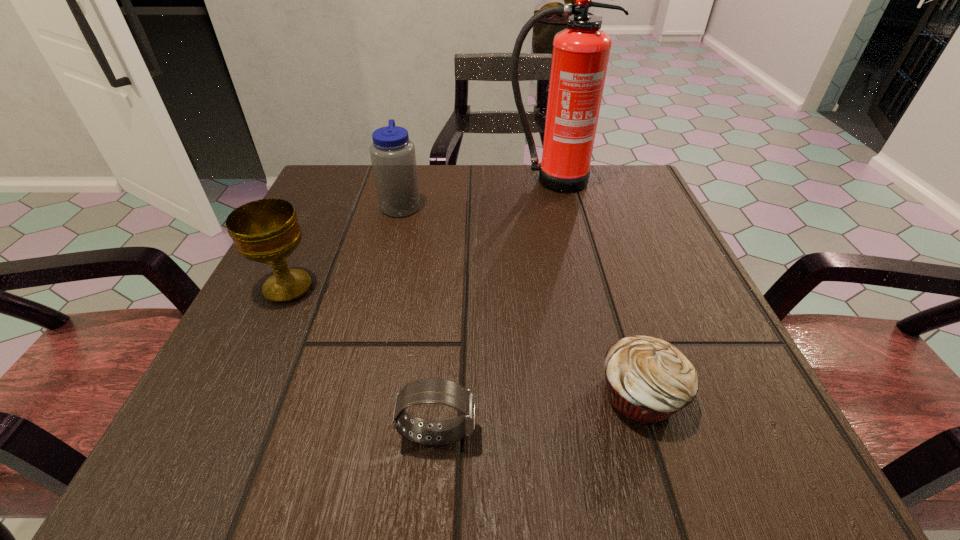
At what (x,y) coordinates should I click in order to perform the action: click on vacant region that satisfies the following two spatial constraints: 1. at the nozzle of the tallest object; 2. with a carrying loop on the side of the fourth object from right to left. Please return your answer as a coordinate pair (x, y). The height and width of the screenshot is (540, 960). Looking at the image, I should click on (557, 205).